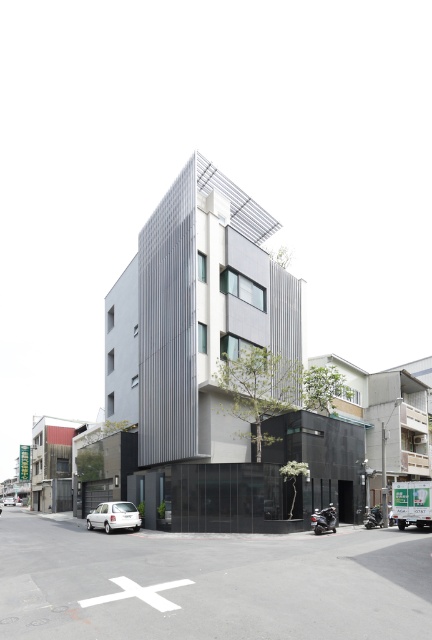
Who is more forward, [120,512] or [5,502]?

Positioned in front is point [120,512].

Can you confirm if white matte car at lower left is positioned above white matte car at center?

Yes, white matte car at lower left is above white matte car at center.

Who is more forward, (126, 516) or (9, 504)?

Point (126, 516) is in front.

The height and width of the screenshot is (640, 432). Identify the location of white matte car at lower left. (114, 516).